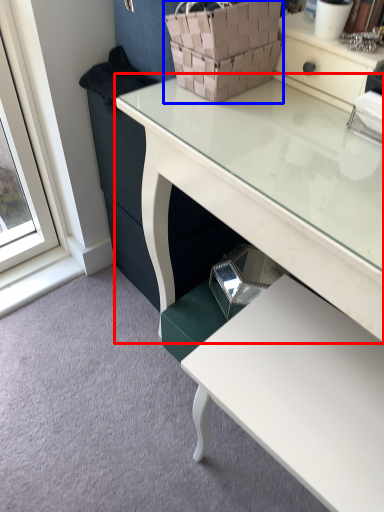
Question: Which object is closer to the camera taking this photo, desk (highlighted by a red box) or basket (highlighted by a blue box)?

Choices:
 (A) desk
 (B) basket

Answer: (A)